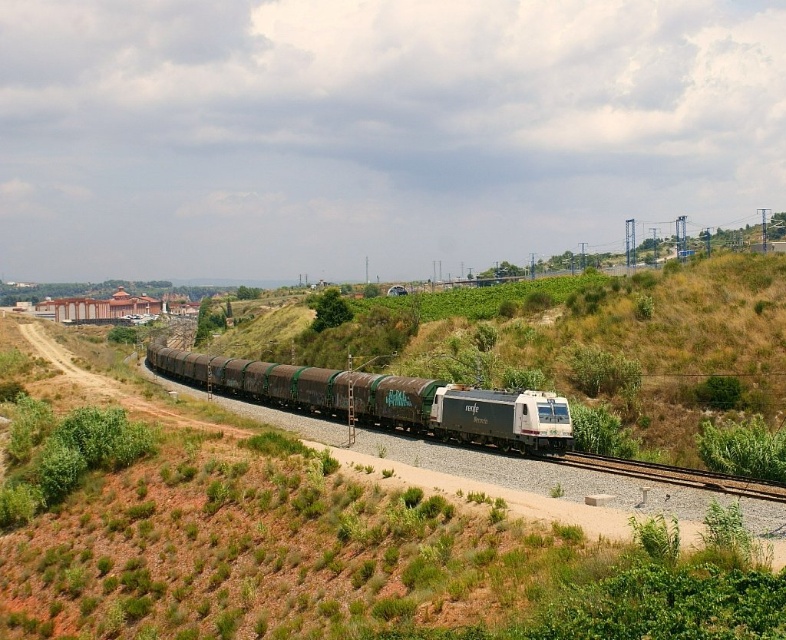
Question: Is matte brown train carriages at center thinner than gravel track at center?

Choices:
 (A) no
 (B) yes

Answer: (A)

Question: Where is matte brown train carriages at center located in relation to gravel track at center in the image?

Choices:
 (A) left
 (B) right

Answer: (A)

Question: Is matte brown train carriages at center to the right of gravel track at center from the viewer's perspective?

Choices:
 (A) no
 (B) yes

Answer: (A)

Question: Which of the following is the closest to the observer?

Choices:
 (A) matte brown train carriages at center
 (B) gravel track at center

Answer: (B)

Question: Which of the following is the closest to the observer?

Choices:
 (A) gravel track at center
 (B) matte brown train carriages at center

Answer: (A)